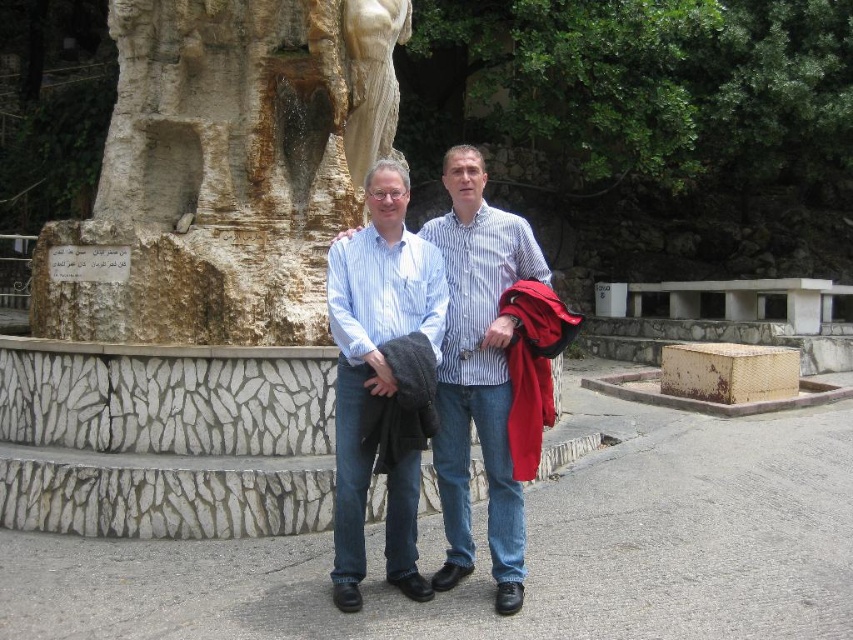
Question: Which point is farther from the camera taking this photo?

Choices:
 (A) (189, 336)
 (B) (459, 186)

Answer: (A)

Question: Which of the following is the closest to the observer?

Choices:
 (A) stone statue at left
 (B) striped cotton shirt at center

Answer: (B)

Question: Is stone statue at left further to camera compared to striped cotton shirt at center?

Choices:
 (A) no
 (B) yes

Answer: (B)

Question: From the image, what is the correct spatial relationship of stone statue at left in relation to striped cotton shirt at center?

Choices:
 (A) right
 (B) left

Answer: (B)

Question: Is stone statue at left in front of striped cotton shirt at center?

Choices:
 (A) yes
 (B) no

Answer: (B)